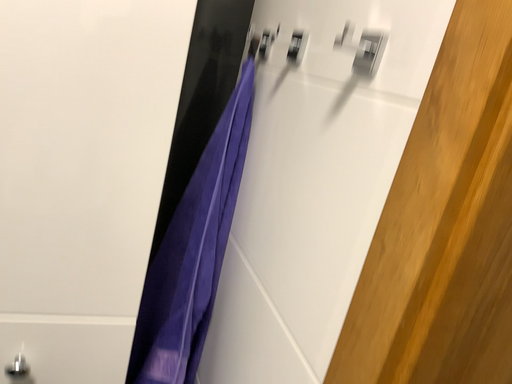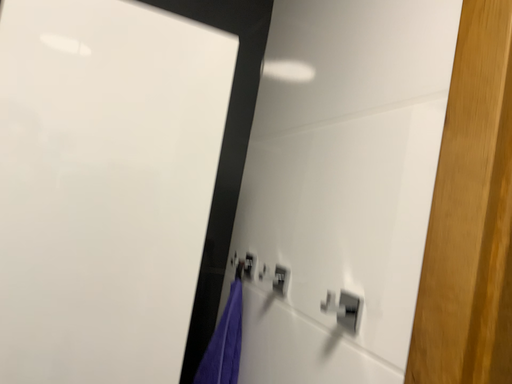
Question: How did the camera likely rotate when shooting the video?

Choices:
 (A) rotated downward
 (B) rotated upward

Answer: (B)